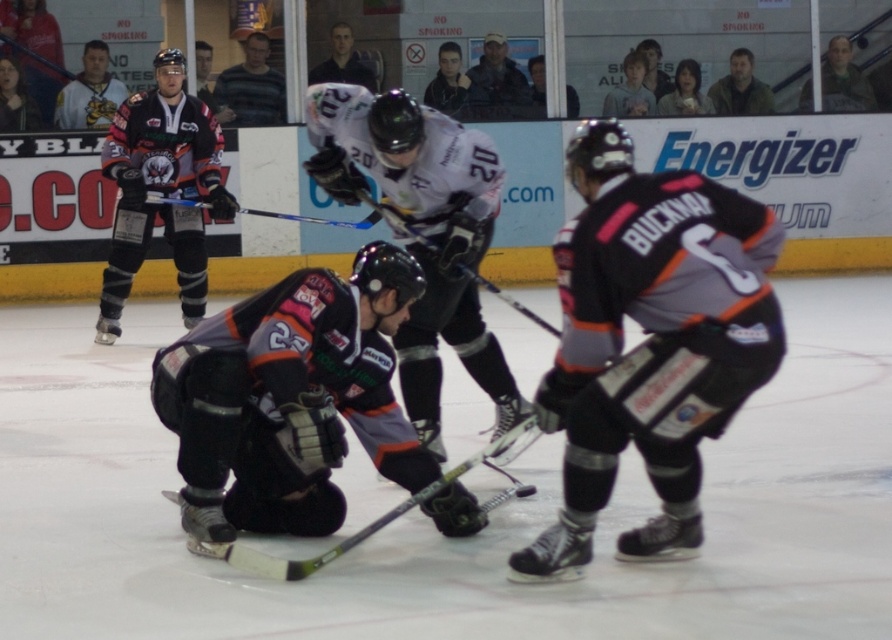
You are an ice hockey player trying to grab your equipment. You see a matte black hockey stick at center located at point (510, 300). If you are standing at point 0.5, 0.5, which direction should you move to reach it?

The matte black hockey stick at center is located at point (510, 300). Since you are at point 0.5, 0.5, you should move northeast to reach it because the hockey stick is northeast of your current position.

You are a referee standing at the edge of the ice rink. You need to measure the distance between the matte black jersey at upper left and the matte black hockey stick at center to determine if a penalty should be called. Can you confirm if the distance is more than 10 feet?

The distance between the matte black jersey at upper left and the matte black hockey stick at center is 12.31 feet, which is more than 10 feet. Therefore, the penalty should not be called as the distance exceeds the required threshold.

You are a referee observing an ice hockey game. You notice two hockey sticks at the center of the rink. Which one is taller between the matte black hockey stick at center and the blue composite hockey stick at center?

The matte black hockey stick at center is taller than the blue composite hockey stick at center.